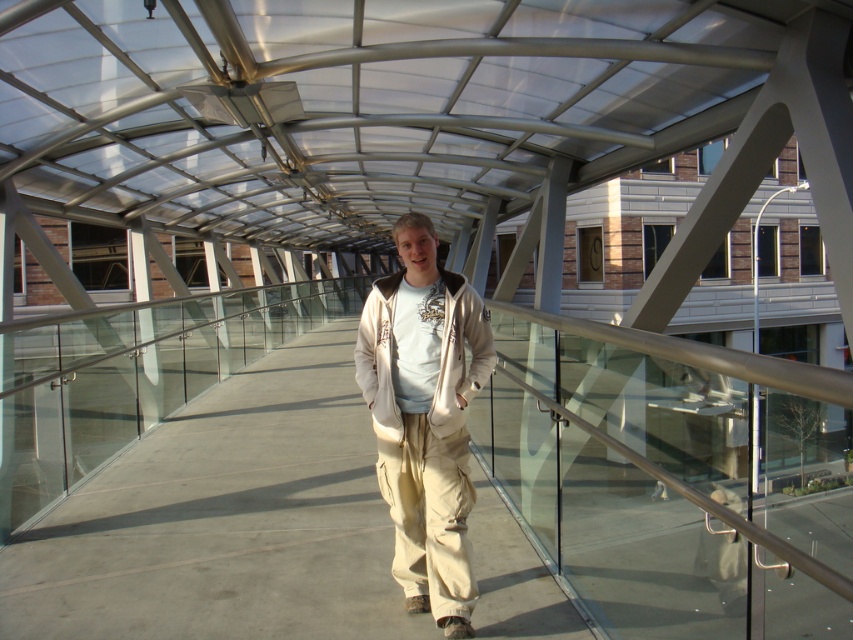
Question: Which point appears farthest from the camera in this image?

Choices:
 (A) pyautogui.click(x=114, y=611)
 (B) pyautogui.click(x=412, y=428)
 (C) pyautogui.click(x=440, y=268)

Answer: (A)

Question: Can you confirm if beige cotton pants at center is thinner than beige fleece sweatshirt at center?

Choices:
 (A) yes
 (B) no

Answer: (A)

Question: Which object is farther from the camera taking this photo?

Choices:
 (A) beige fabric pants at center
 (B) beige cotton pants at center
 (C) beige fleece sweatshirt at center

Answer: (A)

Question: Which object is positioned farthest from the beige cotton pants at center?

Choices:
 (A) beige fabric pants at center
 (B) beige fleece sweatshirt at center

Answer: (A)

Question: Does beige fabric pants at center appear on the right side of beige fleece sweatshirt at center?

Choices:
 (A) yes
 (B) no

Answer: (B)

Question: Observing the image, what is the correct spatial positioning of beige cotton pants at center in reference to beige fleece sweatshirt at center?

Choices:
 (A) left
 (B) right

Answer: (A)